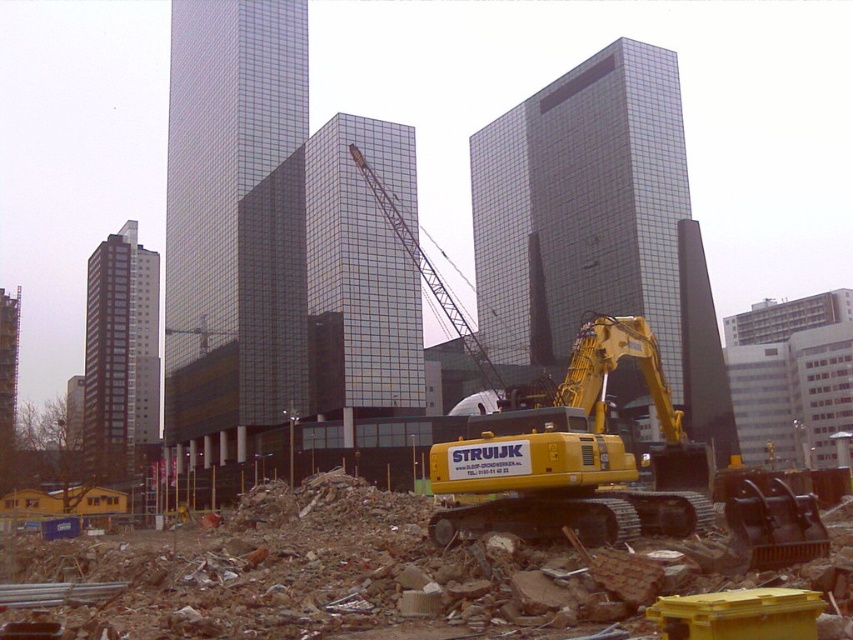
Question: Which of these objects is positioned closest to the metallic yellow crane at center?

Choices:
 (A) yellow rubber tracked excavator at center
 (B) yellow metallic excavator at center

Answer: (A)

Question: Does yellow metallic excavator at center have a greater width compared to metallic yellow crane at center?

Choices:
 (A) no
 (B) yes

Answer: (A)

Question: Which point is farther to the camera?

Choices:
 (A) (263, 602)
 (B) (416, 253)
 (C) (537, 422)

Answer: (B)

Question: Which of the following is the closest to the observer?

Choices:
 (A) (352, 148)
 (B) (18, 600)

Answer: (B)

Question: Is yellow rubber tracked excavator at center smaller than metallic yellow crane at center?

Choices:
 (A) yes
 (B) no

Answer: (A)

Question: Can you confirm if yellow rubber tracked excavator at center is positioned to the left of metallic yellow crane at center?

Choices:
 (A) no
 (B) yes

Answer: (B)